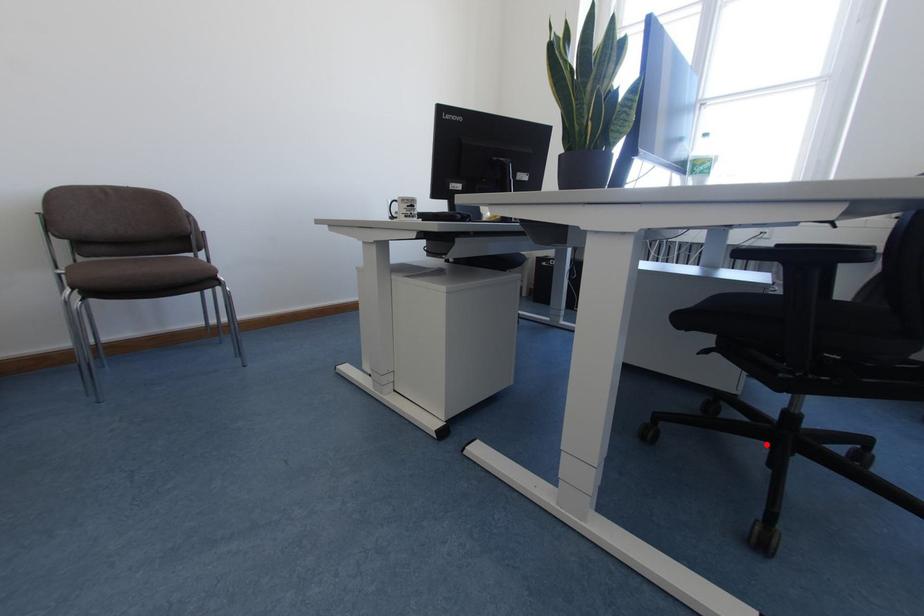
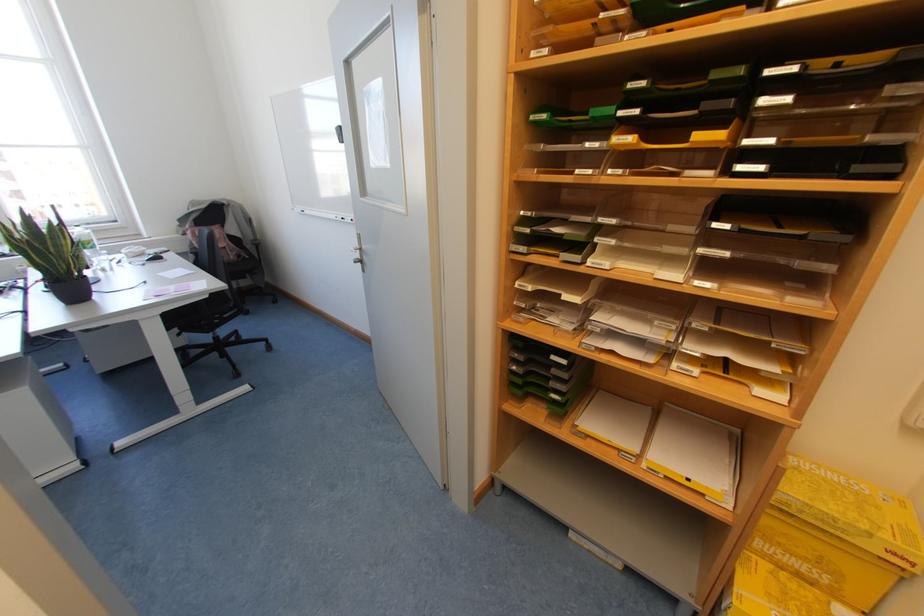
Question: A red point is marked in image1. In image2, is the corresponding 3D point closer to the camera or farther? Reply with the corresponding letter.

Choices:
 (A) The corresponding 3D point is closer.
 (B) The corresponding 3D point is farther.

Answer: (A)